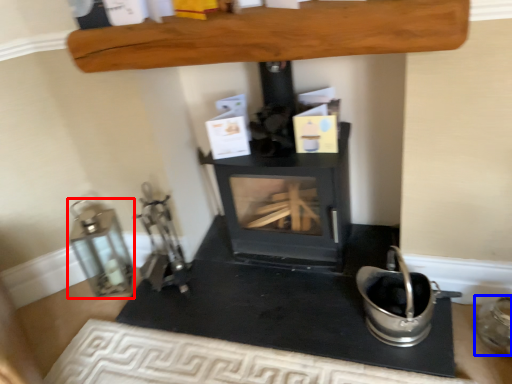
Question: Which object is closer to the camera taking this photo, appliance (highlighted by a red box) or appliance (highlighted by a blue box)?

Choices:
 (A) appliance
 (B) appliance

Answer: (B)